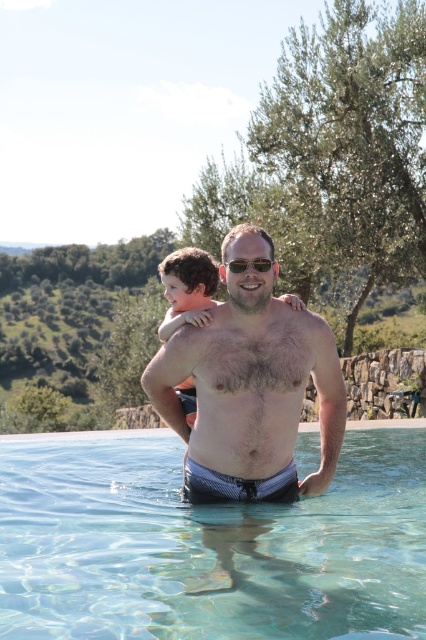
You are a drone operator who needs to capture a photo of both the green leafy olive tree at upper right and the black plastic sunglasses at center. The drone can only focus on objects within 20 meters of each other. Can you capture both in one photo without moving the drone?

The distance between the green leafy olive tree at upper right and the black plastic sunglasses at center is 18.37 meters, which is within the 20 meters range. Therefore, the drone can capture both in one photo without moving.

You are a photographer taking a picture of the green leafy olive tree at upper right and the black plastic sunglasses at center. Which object is positioned higher in the frame?

The green leafy olive tree at upper right is positioned higher in the frame than the black plastic sunglasses at center.